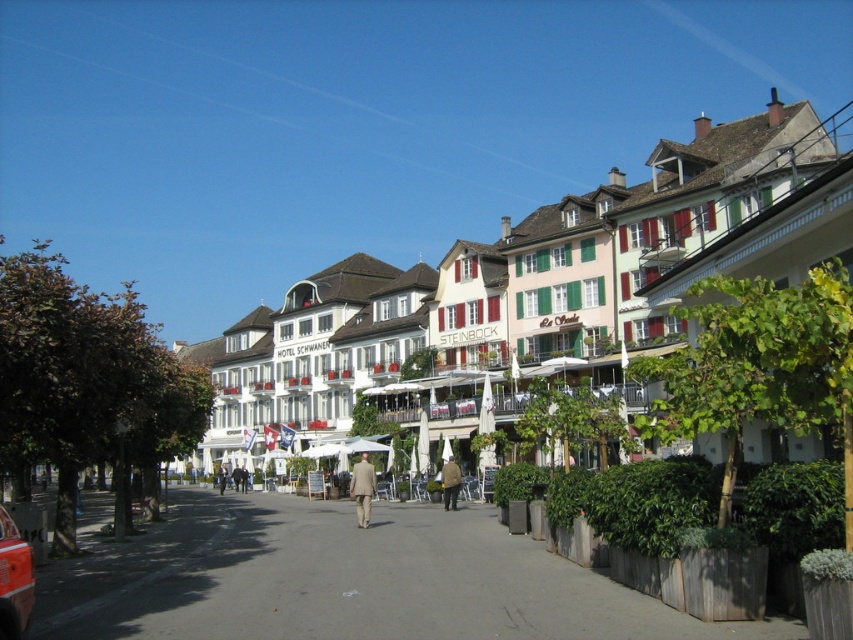
Which is in front, point (302, 296) or point (368, 492)?

Point (368, 492)

Does white matte building at center have a lesser height compared to light beige suit at center?

No, white matte building at center is not shorter than light beige suit at center.

Image resolution: width=853 pixels, height=640 pixels. I want to click on white matte building at center, so click(503, 284).

Which of these two, light beige suit at center or brown leather jacket at center, stands taller?

light beige suit at center is taller.

Does point (366, 500) lie behind point (444, 488)?

No, it is in front of (444, 488).

Where is `light beige suit at center`? The height and width of the screenshot is (640, 853). light beige suit at center is located at coordinates point(363,488).

Who is shorter, metallic red car at lower left or brown leather jacket at center?

With less height is metallic red car at lower left.

Is point (6, 620) closer to viewer compared to point (457, 486)?

Yes, it is.

Who is more forward, (19, 624) or (451, 458)?

Positioned in front is point (19, 624).

Identify the location of metallic red car at lower left. The image size is (853, 640). (15, 579).